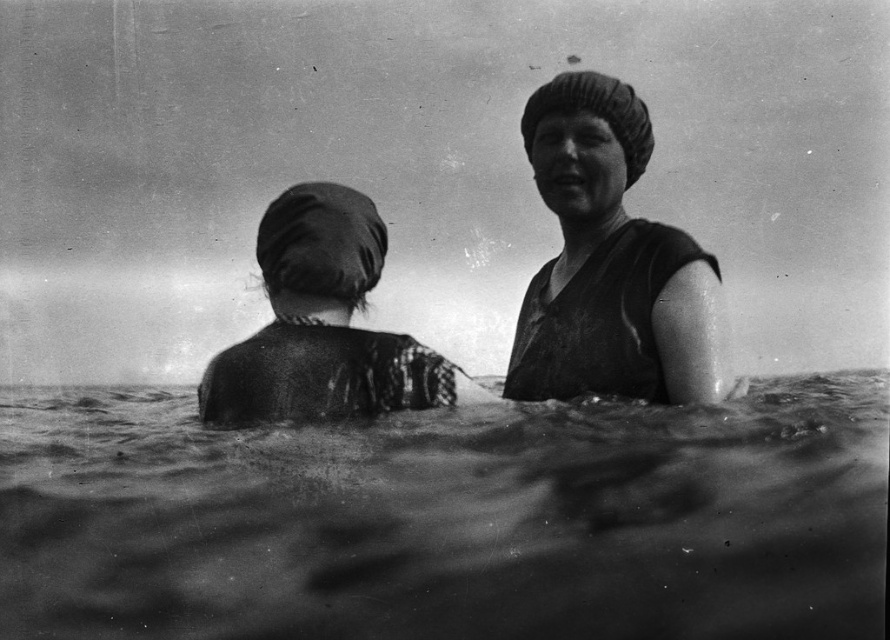
Question: Does smooth fabric swim cap at upper right come behind dark fabric headscarf at left?

Choices:
 (A) no
 (B) yes

Answer: (B)

Question: Is smooth fabric swim cap at upper right below dark fabric headscarf at left?

Choices:
 (A) yes
 (B) no

Answer: (B)

Question: Can you confirm if rough textured water at center is thinner than smooth fabric swim cap at upper right?

Choices:
 (A) yes
 (B) no

Answer: (B)

Question: Based on their relative distances, which object is nearer to the rough textured water at center?

Choices:
 (A) dark fabric headscarf at left
 (B) smooth fabric swim cap at upper right

Answer: (A)

Question: Which object is farther from the camera taking this photo?

Choices:
 (A) rough textured water at center
 (B) smooth fabric swim cap at upper right
 (C) dark fabric headscarf at left

Answer: (B)

Question: Which point is closer to the camera taking this photo?

Choices:
 (A) (100, 552)
 (B) (261, 385)

Answer: (A)